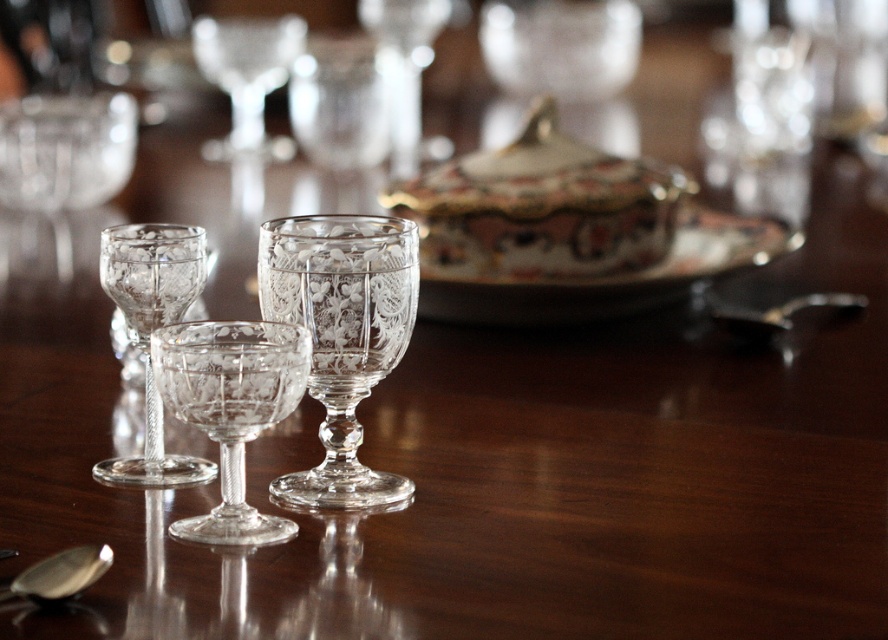
Question: Can you confirm if transparent crystal wine glass at center is thinner than decorative ceramic plate at center?

Choices:
 (A) no
 (B) yes

Answer: (B)

Question: Which of these objects is positioned farthest from the clear crystal wine glass at center?

Choices:
 (A) polished silver spoon at lower right
 (B) clear crystal goblet at center

Answer: (B)

Question: Does clear crystal wine glass at left appear under silver metallic spoon at lower left?

Choices:
 (A) no
 (B) yes

Answer: (A)

Question: Can you confirm if clear crystal wine glass at left is wider than polished silver spoon at lower right?

Choices:
 (A) yes
 (B) no

Answer: (B)

Question: Which point is farther to the camera?

Choices:
 (A) (403, 308)
 (B) (276, 369)

Answer: (A)

Question: Which point is farther from the camera taking this photo?

Choices:
 (A) (176, 481)
 (B) (435, 269)
 (C) (226, 346)
 (D) (347, 394)

Answer: (B)